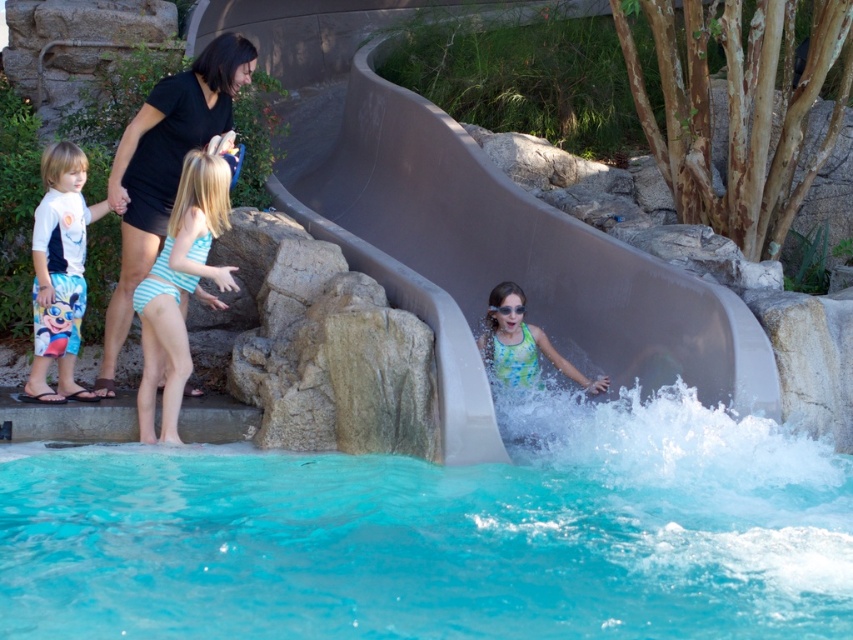
Question: From the image, what is the correct spatial relationship of smooth gray slide at center in relation to blue striped swimsuit at left?

Choices:
 (A) below
 (B) above

Answer: (B)

Question: Does black matte dress at upper left come in front of blue striped swimsuit at left?

Choices:
 (A) no
 (B) yes

Answer: (A)

Question: Which object is the farthest from the black matte dress at upper left?

Choices:
 (A) blue striped swimsuit at left
 (B) multicolored board shorts at left

Answer: (A)

Question: Is black matte dress at upper left closer to camera compared to blue striped swimsuit at left?

Choices:
 (A) yes
 (B) no

Answer: (B)

Question: Which of these objects is positioned closest to the blue striped swimsuit at left?

Choices:
 (A) multicolored board shorts at left
 (B) black matte dress at upper left
 (C) transparent plastic goggles at center
 (D) clear blue water at lower center

Answer: (B)

Question: Which point is farther to the camera?

Choices:
 (A) black matte dress at upper left
 (B) clear blue water at lower center

Answer: (A)